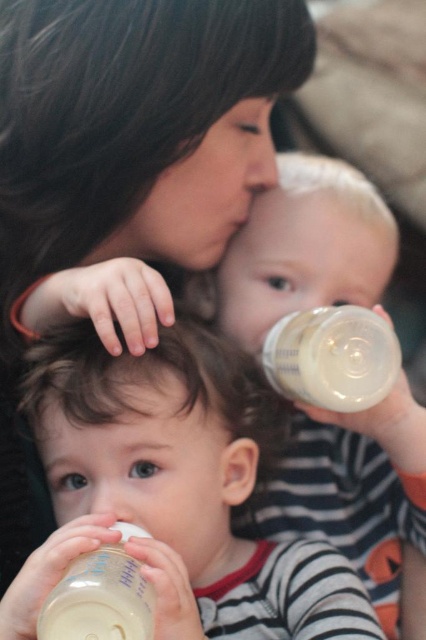
You are a parent trying to choose between two bottles for your baby. The white glossy bottle at center is wider than the translucent plastic bottle at center. Which bottle should you pick if you want the one that can hold more liquid?

The white glossy bottle at center can hold more liquid because it is wider than the translucent plastic bottle at center.